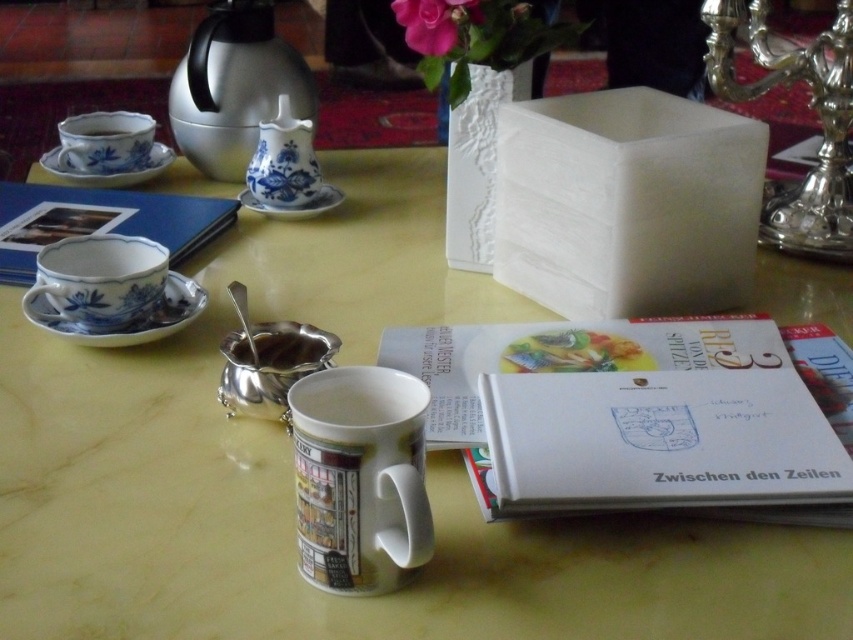
Does white glossy mug at center appear on the right side of shiny metallic tea pot at upper left?

Correct, you'll find white glossy mug at center to the right of shiny metallic tea pot at upper left.

Can you confirm if white glossy mug at center is shorter than shiny metallic tea pot at upper left?

Indeed, white glossy mug at center has a lesser height compared to shiny metallic tea pot at upper left.

The image size is (853, 640). In order to click on white glossy mug at center in this screenshot , I will do `click(358, 477)`.

Can you confirm if blue and white ceramic book at upper left is wider than blue porcelain teacup at left?

Yes, blue and white ceramic book at upper left is wider than blue porcelain teacup at left.

Find the location of a particular element. blue and white ceramic book at upper left is located at coordinates (100, 221).

What do you see at coordinates (100, 221) in the screenshot? The width and height of the screenshot is (853, 640). I see `blue and white ceramic book at upper left` at bounding box center [100, 221].

Where is `blue and white ceramic book at upper left`? The width and height of the screenshot is (853, 640). blue and white ceramic book at upper left is located at coordinates (100, 221).

Consider the image. Who is positioned more to the right, blue porcelain teacup at left or blue porcelain saucer at upper left?

blue porcelain teacup at left is more to the right.

In the scene shown: Does blue porcelain teacup at left have a lesser height compared to blue porcelain saucer at upper left?

No.

This screenshot has width=853, height=640. What do you see at coordinates (99, 280) in the screenshot?
I see `blue porcelain teacup at left` at bounding box center [99, 280].

In order to click on blue porcelain teacup at left in this screenshot , I will do `click(99, 280)`.